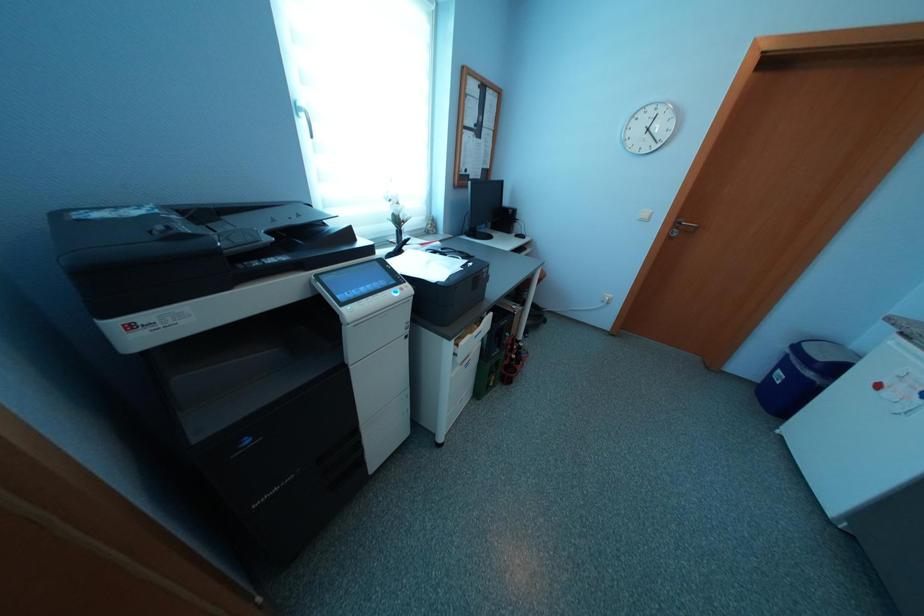
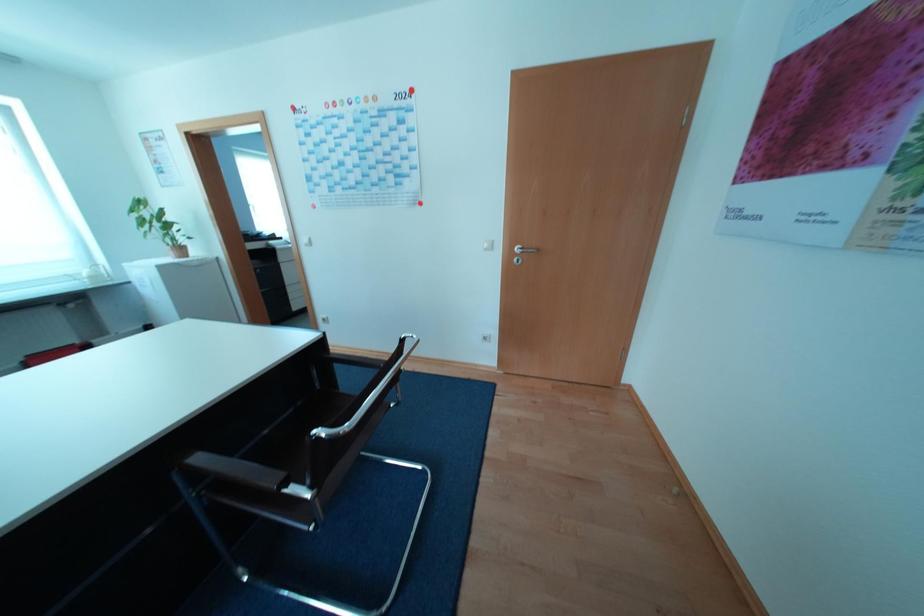
In a continuous first-person perspective shot, in which direction is the camera moving?

The cameraman walked toward right, backward.